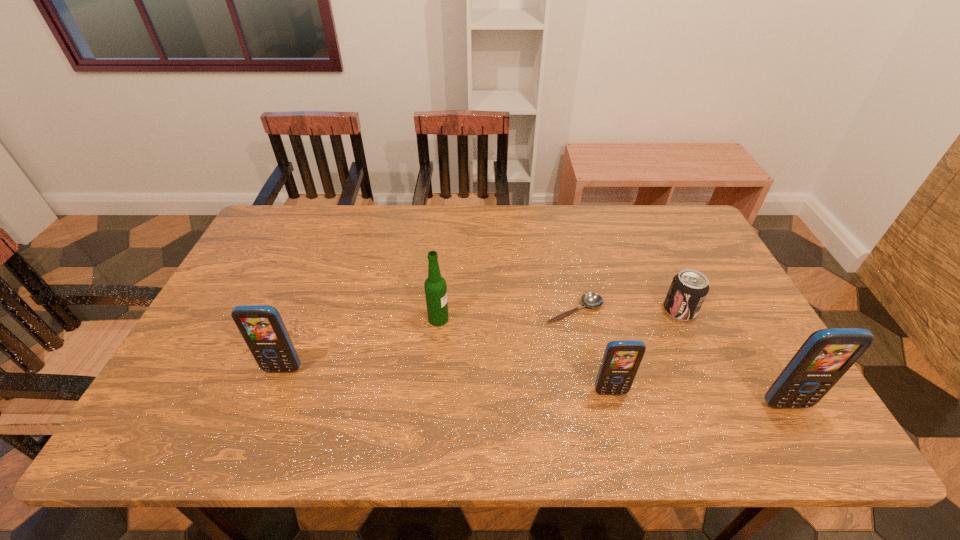
Locate an element on the screen. vacant space positioned on the label of the second object from left to right is located at coordinates (522, 319).

What are the coordinates of `vacant space located on the back of the second object from right to left` in the screenshot? It's located at (664, 277).

What are the coordinates of `cellular telephone that is at the right edge` in the screenshot? It's located at (827, 354).

You are a GUI agent. You are given a task and a screenshot of the screen. Output one action in this format:
    pyautogui.click(x=<x>, y=<y>)
    Task: Click on the soda can that is at the right edge
    The image size is (960, 540).
    Given the screenshot: What is the action you would take?
    pyautogui.click(x=689, y=288)

What are the coordinates of `object that is at the near right corner` in the screenshot? It's located at (827, 354).

In order to click on vacant space at the far edge of the desktop in this screenshot , I will do `click(549, 207)`.

The width and height of the screenshot is (960, 540). What are the coordinates of `free space at the near edge` in the screenshot? It's located at (389, 388).

Find the location of a particular element. vacant space at the left edge of the desktop is located at coordinates (238, 297).

Identify the location of free location at the right edge of the desktop. (718, 306).

The image size is (960, 540). In order to click on vacant space at the far left corner of the desktop in this screenshot , I will do `click(273, 246)`.